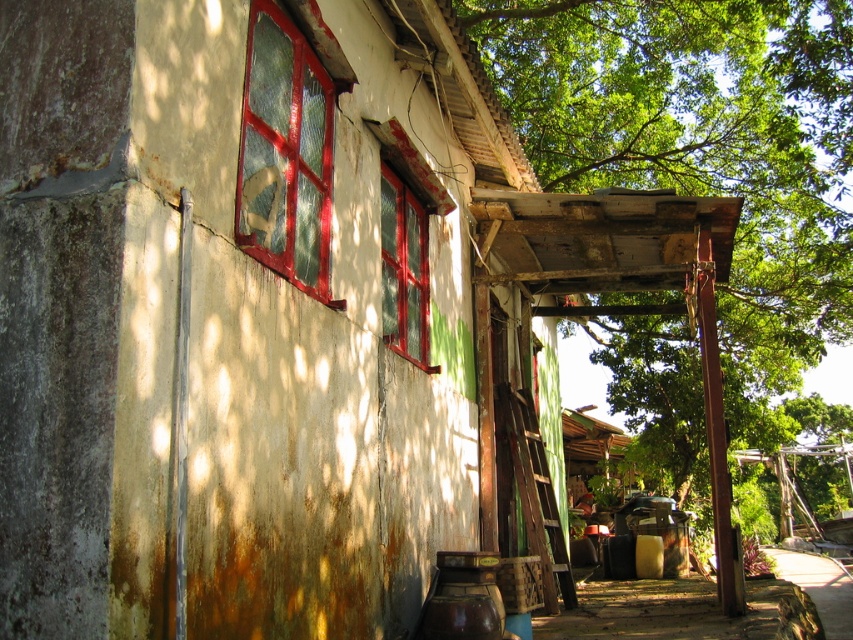
Question: Considering the real-world distances, which object is closest to the matte glass window at center?

Choices:
 (A) cracked glass window at left
 (B) green leafy tree at upper right

Answer: (A)

Question: Does green leafy tree at upper right come behind cracked glass window at left?

Choices:
 (A) no
 (B) yes

Answer: (B)

Question: Can you confirm if cracked glass window at left is wider than matte glass window at center?

Choices:
 (A) yes
 (B) no

Answer: (B)

Question: Is green leafy tree at upper right above matte glass window at center?

Choices:
 (A) no
 (B) yes

Answer: (B)

Question: Which of the following is the farthest from the observer?

Choices:
 (A) (287, 76)
 (B) (427, 230)
 (C) (670, 404)

Answer: (C)

Question: Which object is positioned closest to the matte glass window at center?

Choices:
 (A) cracked glass window at left
 (B) brown wooden alley at lower right

Answer: (A)